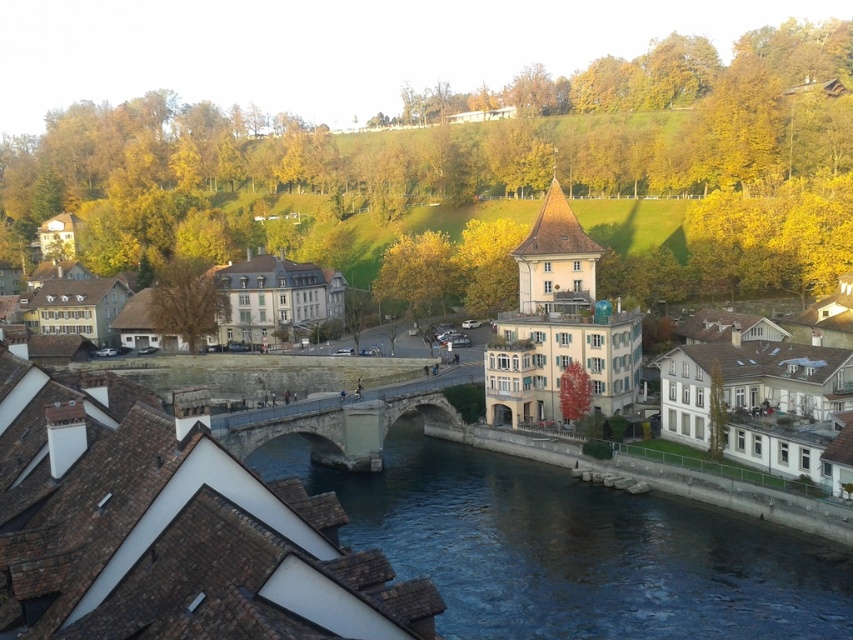
You are standing at the center of the town square, which is located at point 0.5, 0.5 on the image. You want to cross the river to reach the other side. Which direction should you head to reach the blue stone bridge at center from your current position?

The blue stone bridge at center is located at point (573, 548), which is northeast of the town square at (426, 320). Therefore, you should head northeast to reach the bridge.